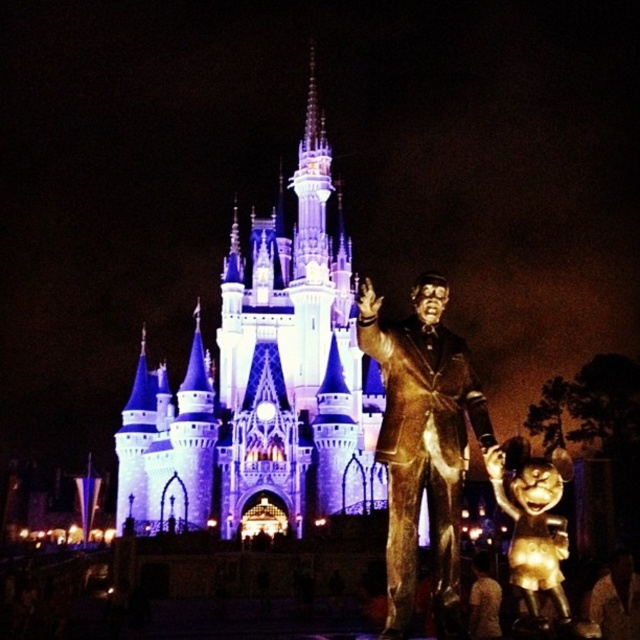
Between illuminated stone castle at center and gold metallic minnie mouse at lower right, which one appears on the left side from the viewer's perspective?

Positioned to the left is illuminated stone castle at center.

Who is higher up, illuminated stone castle at center or gold metallic minnie mouse at lower right?

illuminated stone castle at center is above.

Which is behind, point (352, 464) or point (577, 634)?

Positioned behind is point (352, 464).

Identify the location of illuminated stone castle at center. (262, 385).

Does illuminated stone castle at center appear under bronze statue at center?

Actually, illuminated stone castle at center is above bronze statue at center.

This screenshot has height=640, width=640. In order to click on illuminated stone castle at center in this screenshot , I will do tap(262, 385).

Locate an element on the screen. This screenshot has height=640, width=640. illuminated stone castle at center is located at coordinates (262, 385).

Is bronze statue at center bigger than gold metallic minnie mouse at lower right?

No, bronze statue at center is not bigger than gold metallic minnie mouse at lower right.

Is bronze statue at center taller than gold metallic minnie mouse at lower right?

Yes, bronze statue at center is taller than gold metallic minnie mouse at lower right.

Locate an element on the screen. The height and width of the screenshot is (640, 640). bronze statue at center is located at coordinates (422, 444).

Where is `bronze statue at center`? The width and height of the screenshot is (640, 640). bronze statue at center is located at coordinates point(422,444).